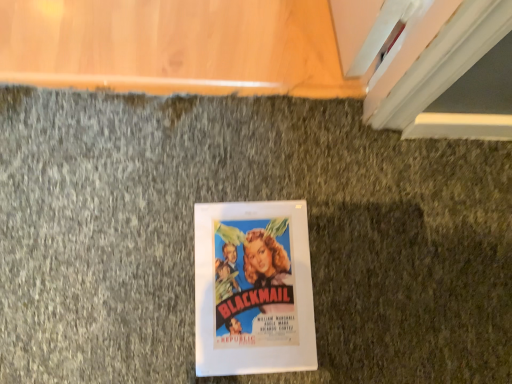
Image resolution: width=512 pixels, height=384 pixels. I want to click on free point above matte paper poster at center (from a real-world perspective), so click(x=253, y=279).